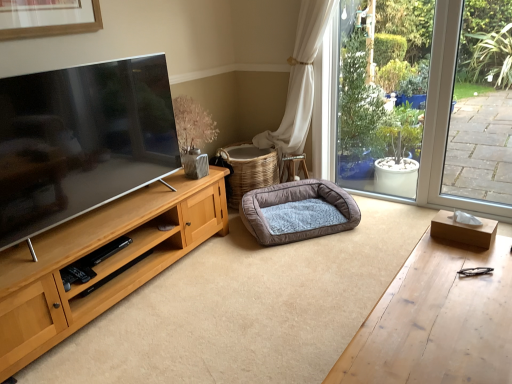
Question: Considering the relative sizes of wooden desk at lower right and woven brown basket at center in the image provided, is wooden desk at lower right bigger than woven brown basket at center?

Choices:
 (A) no
 (B) yes

Answer: (B)

Question: From the image's perspective, is wooden desk at lower right under woven brown basket at center?

Choices:
 (A) no
 (B) yes

Answer: (B)

Question: Are wooden desk at lower right and woven brown basket at center making contact?

Choices:
 (A) no
 (B) yes

Answer: (A)

Question: Is wooden desk at lower right thinner than woven brown basket at center?

Choices:
 (A) no
 (B) yes

Answer: (B)

Question: Could you tell me if wooden desk at lower right is facing woven brown basket at center?

Choices:
 (A) yes
 (B) no

Answer: (A)

Question: Would you say wooden desk at lower right is to the left or to the right of brown plush dog bed at center in the picture?

Choices:
 (A) left
 (B) right

Answer: (B)

Question: In terms of size, does wooden desk at lower right appear bigger or smaller than brown plush dog bed at center?

Choices:
 (A) big
 (B) small

Answer: (A)

Question: From the image's perspective, is wooden desk at lower right positioned above or below brown plush dog bed at center?

Choices:
 (A) above
 (B) below

Answer: (B)

Question: From a real-world perspective, is wooden desk at lower right above or below brown plush dog bed at center?

Choices:
 (A) above
 (B) below

Answer: (A)

Question: Visually, is brown plush dog bed at center positioned to the left or to the right of woven brown basket at center?

Choices:
 (A) right
 (B) left

Answer: (A)

Question: Is brown plush dog bed at center bigger or smaller than woven brown basket at center?

Choices:
 (A) big
 (B) small

Answer: (B)

Question: Is brown plush dog bed at center spatially inside woven brown basket at center, or outside of it?

Choices:
 (A) outside
 (B) inside

Answer: (A)

Question: In terms of width, does brown plush dog bed at center look wider or thinner when compared to woven brown basket at center?

Choices:
 (A) thin
 (B) wide

Answer: (B)

Question: In terms of height, does woven brown basket at center look taller or shorter compared to brown plush dog bed at center?

Choices:
 (A) tall
 (B) short

Answer: (A)

Question: Considering the positions of woven brown basket at center and brown plush dog bed at center in the image, is woven brown basket at center wider or thinner than brown plush dog bed at center?

Choices:
 (A) wide
 (B) thin

Answer: (B)